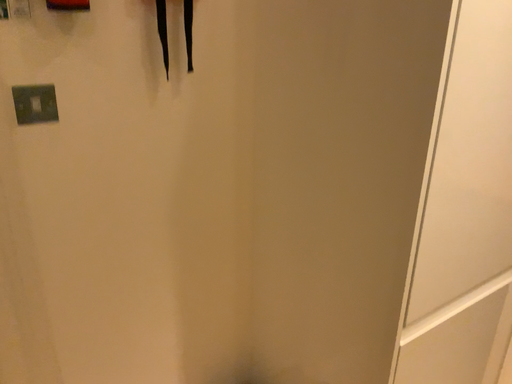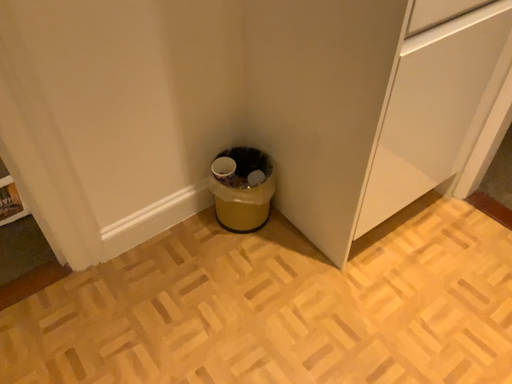
Question: Which way did the camera rotate in the video?

Choices:
 (A) rotated upward
 (B) rotated downward

Answer: (B)